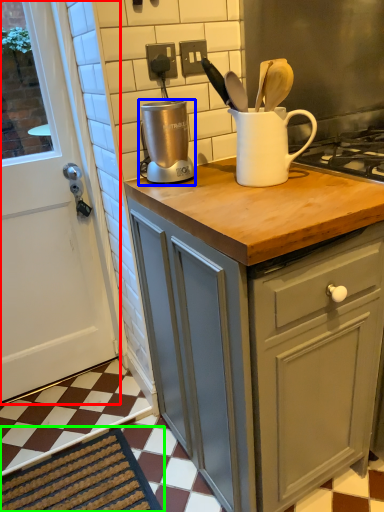
Question: Which is farther away from door (highlighted by a red box)? kitchen appliance (highlighted by a blue box) or doormat (highlighted by a green box)?

Choices:
 (A) kitchen appliance
 (B) doormat

Answer: (A)